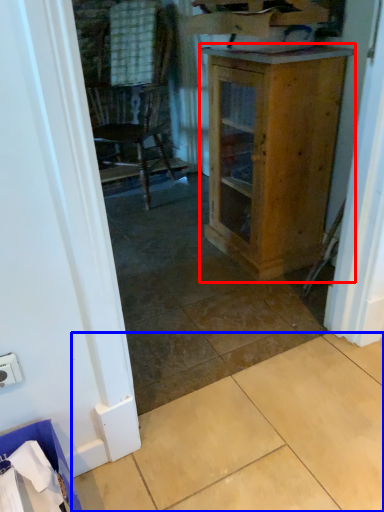
Question: Which point is closer to the camera, cabinetry (highlighted by a red box) or tile (highlighted by a blue box)?

Choices:
 (A) cabinetry
 (B) tile

Answer: (B)